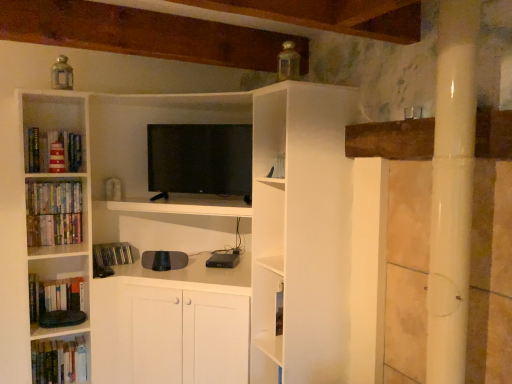
At what (x,y) coordinates should I click in order to perform the action: click on hardcover books at left, which appears as the second book when viewed from the top. Please return your answer as a coordinate pair (x, y). The height and width of the screenshot is (384, 512). Looking at the image, I should click on (53, 197).

Find the location of a particular element. The image size is (512, 384). matte black cd case at lower left, the 4th book viewed from the top is located at coordinates (114, 254).

Measure the distance between flat screen tv at center and camera.

The distance of flat screen tv at center from camera is 8.47 feet.

Find the location of a particular element. red striped lighthouse at left, marked as the first book in a top-to-bottom arrangement is located at coordinates (50, 151).

Considering the points (40, 142) and (74, 186), which point is behind, point (40, 142) or point (74, 186)?

The point (74, 186) is more distant.

Between red striped lighthouse at left, which is the sixth book from bottom to top, and hardcover books at left, which is counted as the 5th book, starting from the bottom, which one has smaller size?

hardcover books at left, which is counted as the 5th book, starting from the bottom, is smaller.

In the scene shown: Is red striped lighthouse at left, marked as the first book in a top-to-bottom arrangement, outside of hardcover books at left, which is counted as the 5th book, starting from the bottom?

red striped lighthouse at left, marked as the first book in a top-to-bottom arrangement, is positioned outside hardcover books at left, which is counted as the 5th book, starting from the bottom.

Is there a large distance between red striped lighthouse at left, which is the sixth book from bottom to top, and hardcover books at left, which appears as the second book when viewed from the top?

They are positioned close to each other.

In terms of width, does hardcover books at left, the first book ordered from the bottom, look wider or thinner when compared to hardcover books at left, the 3th book from the top?

Clearly, hardcover books at left, the first book ordered from the bottom, has more width compared to hardcover books at left, the 3th book from the top.

Is hardcover books at left, the 3th book from the top, at the back of hardcover books at left, the first book ordered from the bottom?

No, hardcover books at left, the first book ordered from the bottom, is not facing away from hardcover books at left, the 3th book from the top.

Identify the location of the 3rd book below the hardcover books at left, the fourth book ordered from the bottom (from a real-world perspective). (59, 361).

From the image's perspective, is hardcover books at left, the 6th book positioned from the top, above or below hardcover books at left, which is counted as the 5th book, starting from the bottom?

Based on their image positions, hardcover books at left, the 6th book positioned from the top, is located beneath hardcover books at left, which is counted as the 5th book, starting from the bottom.

Is hardcover books at left, the first book ordered from the bottom, smaller than hardcover books at left, which appears as the second book when viewed from the top?

Actually, hardcover books at left, the first book ordered from the bottom, might be larger than hardcover books at left, which appears as the second book when viewed from the top.

Is hardcover books at left, the first book ordered from the bottom, positioned beyond the bounds of hardcover books at left, which appears as the second book when viewed from the top?

That's correct, hardcover books at left, the first book ordered from the bottom, is outside of hardcover books at left, which appears as the second book when viewed from the top.

Which object is further away from the camera taking this photo, hardcover books at left, the 6th book positioned from the top, or hardcover books at left, which appears as the second book when viewed from the top?

hardcover books at left, the 6th book positioned from the top, is further away from the camera.

Which is more to the right, hardcover books at left, which appears as the second book when viewed from the top, or red striped lighthouse at left, marked as the first book in a top-to-bottom arrangement?

red striped lighthouse at left, marked as the first book in a top-to-bottom arrangement.

Is hardcover books at left, which appears as the second book when viewed from the top, facing away from red striped lighthouse at left, marked as the first book in a top-to-bottom arrangement?

No, red striped lighthouse at left, marked as the first book in a top-to-bottom arrangement, is not at the back of hardcover books at left, which appears as the second book when viewed from the top.

Does hardcover books at left, which is counted as the 5th book, starting from the bottom, come in front of red striped lighthouse at left, which is the sixth book from bottom to top?

That is False.

From a real-world perspective, is hardcover books at left, which appears as the second book when viewed from the top, physically located above or below red striped lighthouse at left, which is the sixth book from bottom to top?

hardcover books at left, which appears as the second book when viewed from the top, is situated lower than red striped lighthouse at left, which is the sixth book from bottom to top, in the real world.

Is red striped lighthouse at left, which is the sixth book from bottom to top, far from hardcover books at left, the fourth book ordered from the bottom?

No, red striped lighthouse at left, which is the sixth book from bottom to top, is in close proximity to hardcover books at left, the fourth book ordered from the bottom.

Which object is positioned more to the left, red striped lighthouse at left, which is the sixth book from bottom to top, or hardcover books at left, the 3th book from the top?

hardcover books at left, the 3th book from the top, is more to the left.

Is red striped lighthouse at left, marked as the first book in a top-to-bottom arrangement, oriented towards hardcover books at left, the fourth book ordered from the bottom?

No, red striped lighthouse at left, marked as the first book in a top-to-bottom arrangement, is not aimed at hardcover books at left, the fourth book ordered from the bottom.

From a real-world perspective, relative to hardcover books at left, the fourth book ordered from the bottom, is red striped lighthouse at left, which is the sixth book from bottom to top, vertically above or below?

Clearly, from a real-world perspective, red striped lighthouse at left, which is the sixth book from bottom to top, is above hardcover books at left, the fourth book ordered from the bottom.

Could you tell me if hardcover books at left, which is counted as the 5th book, starting from the bottom, is turned towards flat screen tv at center?

No.

In the scene shown: Choose the correct answer: Is hardcover books at left, which is counted as the 5th book, starting from the bottom, inside flat screen tv at center or outside it?

hardcover books at left, which is counted as the 5th book, starting from the bottom, is spatially situated outside flat screen tv at center.

From a real-world perspective, which is physically above, hardcover books at left, which appears as the second book when viewed from the top, or flat screen tv at center?

From a 3D spatial view, flat screen tv at center is above.

Looking at their sizes, would you say hardcover books at left, the fourth book ordered from the bottom, is wider or thinner than flat screen tv at center?

In the image, hardcover books at left, the fourth book ordered from the bottom, appears to be more narrow than flat screen tv at center.

From the image's perspective, is hardcover books at left, the 3th book from the top, positioned above or below flat screen tv at center?

hardcover books at left, the 3th book from the top, is situated lower than flat screen tv at center in the image.

Which object is positioned more to the left, hardcover books at left, the 3th book from the top, or flat screen tv at center?

hardcover books at left, the 3th book from the top.

Is the position of hardcover books at left, the fourth book ordered from the bottom, less distant than that of flat screen tv at center?

No, it is not.

Which book is the 1st one when counting from the left side of the red striped lighthouse at left, marked as the first book in a top-to-bottom arrangement? Please provide its 2D coordinates.

[(53, 197)]

Starting from the hardcover books at left, the 6th book positioned from the top, which book is the 1st one in front? Please provide its 2D coordinates.

[(54, 229)]

Consider the image. Which object lies nearer to the anchor point red striped lighthouse at left, which is the sixth book from bottom to top, hardcover books at lower left, which ranks as the 5th book in top-to-bottom order, or hardcover books at left, the 3th book from the top?

Among the two, hardcover books at left, the 3th book from the top, is located nearer to red striped lighthouse at left, which is the sixth book from bottom to top.

Looking at the image, which one is located closer to hardcover books at left, which appears as the second book when viewed from the top, hardcover books at left, the 6th book positioned from the top, or matte black cd case at lower left, the third book in the bottom-to-top sequence?

matte black cd case at lower left, the third book in the bottom-to-top sequence.

Considering their positions, is hardcover books at left, the fourth book ordered from the bottom, positioned closer to hardcover books at lower left, which is the 2th book from bottom to top, than red striped lighthouse at left, which is the sixth book from bottom to top?

hardcover books at left, the fourth book ordered from the bottom, is closer to hardcover books at lower left, which is the 2th book from bottom to top.

Considering their positions, is hardcover books at left, which appears as the second book when viewed from the top, positioned further to hardcover books at left, the first book ordered from the bottom, than hardcover books at left, the 3th book from the top?

Based on the image, hardcover books at left, which appears as the second book when viewed from the top, appears to be further to hardcover books at left, the first book ordered from the bottom.

In the scene shown: Which object lies further to the anchor point matte black cd case at lower left, the 4th book viewed from the top, hardcover books at left, the fourth book ordered from the bottom, or hardcover books at left, which appears as the second book when viewed from the top?

hardcover books at left, which appears as the second book when viewed from the top, lies further to matte black cd case at lower left, the 4th book viewed from the top, than the other object.

From the image, which object appears to be farther from hardcover books at left, the 3th book from the top, red striped lighthouse at left, marked as the first book in a top-to-bottom arrangement, or hardcover books at left, which appears as the second book when viewed from the top?

The object further to hardcover books at left, the 3th book from the top, is red striped lighthouse at left, marked as the first book in a top-to-bottom arrangement.

When comparing their distances from hardcover books at left, the fourth book ordered from the bottom, does hardcover books at left, which is counted as the 5th book, starting from the bottom, or flat screen tv at center seem further?

flat screen tv at center is positioned further to the anchor hardcover books at left, the fourth book ordered from the bottom.

From the image, which object appears to be farther from hardcover books at left, the 6th book positioned from the top, hardcover books at left, which is counted as the 5th book, starting from the bottom, or matte black cd case at lower left, the 4th book viewed from the top?

→ hardcover books at left, which is counted as the 5th book, starting from the bottom, is further to hardcover books at left, the 6th book positioned from the top.

You are a GUI agent. You are given a task and a screenshot of the screen. Output one action in this format:
    pyautogui.click(x=<x>, y=<y>)
    Task: Click on the book between hardcover books at left, the 3th book from the top, and hardcover books at lower left, which is the 2th book from bottom to top, in the up-down direction
    The height and width of the screenshot is (384, 512).
    Given the screenshot: What is the action you would take?
    pyautogui.click(x=114, y=254)

Find the location of a particular element. television between red striped lighthouse at left, which is the sixth book from bottom to top, and hardcover books at left, the 6th book positioned from the top, in the vertical direction is located at coordinates (200, 158).

Locate an element on the screen. Image resolution: width=512 pixels, height=384 pixels. book between hardcover books at left, which is counted as the 5th book, starting from the bottom, and matte black cd case at lower left, the third book in the bottom-to-top sequence, in the vertical direction is located at coordinates (54, 229).

Find the location of a particular element. The height and width of the screenshot is (384, 512). book that lies between red striped lighthouse at left, marked as the first book in a top-to-bottom arrangement, and hardcover books at left, the fourth book ordered from the bottom, from top to bottom is located at coordinates (53, 197).